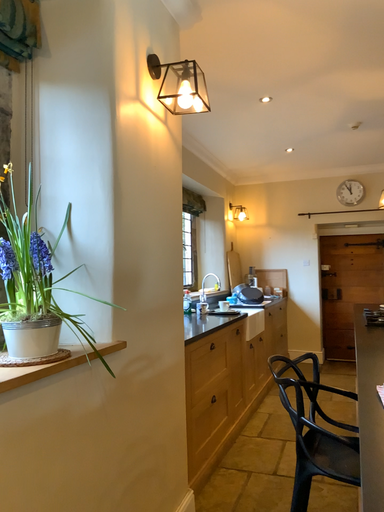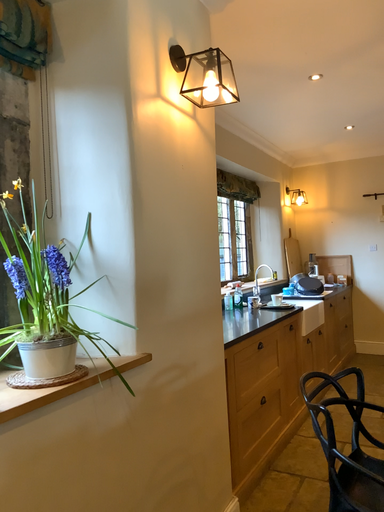
Question: Which way did the camera rotate in the video?

Choices:
 (A) rotated left
 (B) rotated right

Answer: (A)